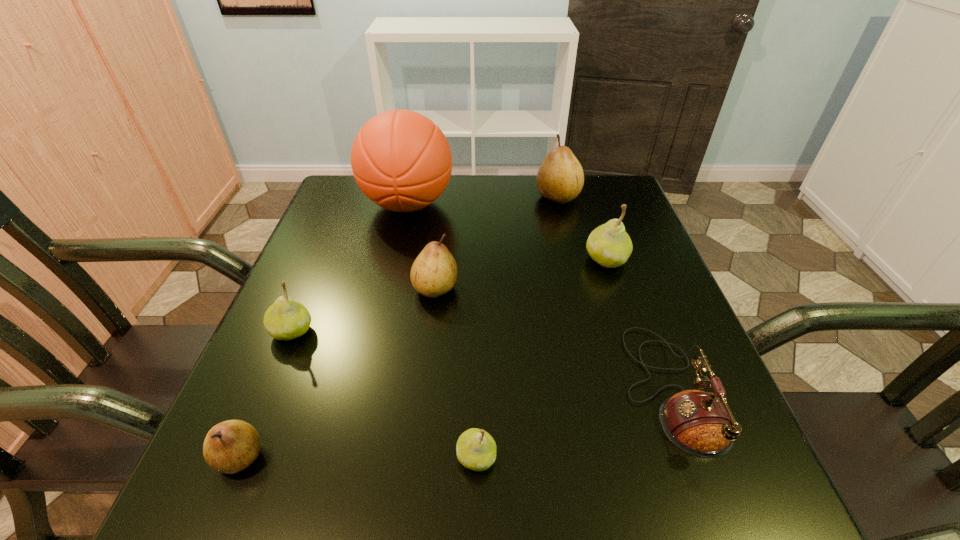
This screenshot has width=960, height=540. Find the location of `object that is positioned at the far left corner`. object that is positioned at the far left corner is located at coordinates (402, 161).

Image resolution: width=960 pixels, height=540 pixels. Find the location of `object present at the near left corner`. object present at the near left corner is located at coordinates (231, 446).

In order to click on object situated at the far right corner in this screenshot , I will do `click(560, 178)`.

Where is `object located at the near right corner`? The height and width of the screenshot is (540, 960). object located at the near right corner is located at coordinates (700, 423).

Where is `vacant point at the far edge`? The height and width of the screenshot is (540, 960). vacant point at the far edge is located at coordinates (501, 213).

In the image, there is a desktop. Where is `free space at the near edge`? Image resolution: width=960 pixels, height=540 pixels. free space at the near edge is located at coordinates (320, 490).

You are a GUI agent. You are given a task and a screenshot of the screen. Output one action in this format:
    pyautogui.click(x=<x>, y=<y>)
    Task: Click on the vacant space at the left edge of the desktop
    The height and width of the screenshot is (540, 960).
    Given the screenshot: What is the action you would take?
    pyautogui.click(x=273, y=400)

The width and height of the screenshot is (960, 540). What are the coordinates of `free space at the right edge` in the screenshot? It's located at (660, 399).

In the image, there is a desktop. Where is `free region at the far right corner`? This screenshot has height=540, width=960. free region at the far right corner is located at coordinates (589, 177).

The width and height of the screenshot is (960, 540). I want to click on free space at the near right corner of the desktop, so click(x=665, y=507).